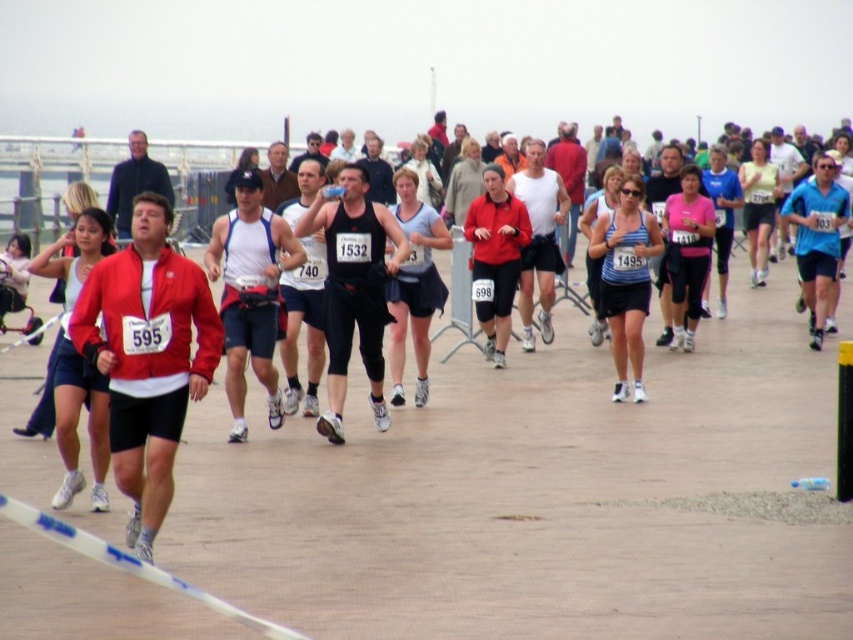
Is point (625, 355) farther from viewer compared to point (428, 246)?

Yes, it is behind point (428, 246).

Describe the element at coordinates (625, 280) in the screenshot. The width and height of the screenshot is (853, 640). I see `blue striped tank top at center` at that location.

Identify the location of blue striped tank top at center. The image size is (853, 640). (625, 280).